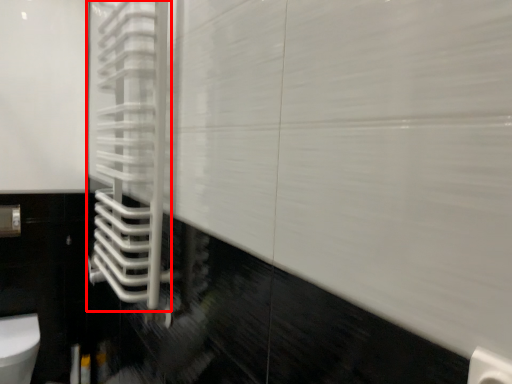
Question: From the image's perspective, what is the correct spatial relationship of shower door (annotated by the red box) in relation to toilet?

Choices:
 (A) below
 (B) above

Answer: (B)